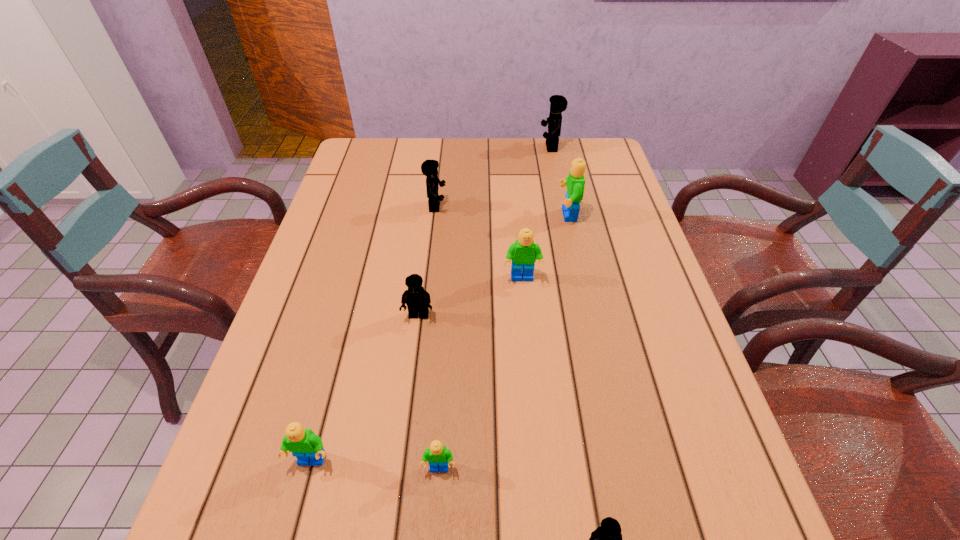
I want to click on vacant area located on the front-facing side of the fifth farthest Lego, so click(x=396, y=496).

Where is `free spot located on the face of the leftmost object`? free spot located on the face of the leftmost object is located at coordinates (300, 503).

At what (x,y) coordinates should I click in order to perform the action: click on object located at the far edge. Please return your answer as a coordinate pair (x, y). Image resolution: width=960 pixels, height=540 pixels. Looking at the image, I should click on (558, 103).

Where is `object located in the left edge section of the desktop`? The image size is (960, 540). object located in the left edge section of the desktop is located at coordinates (305, 445).

Identify the location of object located at the right edge. (558, 103).

At what (x,y) coordinates should I click in order to perform the action: click on object that is at the far right corner. Please return your answer as a coordinate pair (x, y). Image resolution: width=960 pixels, height=540 pixels. Looking at the image, I should click on (558, 103).

Find the location of `vacant position at the far edge of the desktop`. vacant position at the far edge of the desktop is located at coordinates (483, 160).

You are a GUI agent. You are given a task and a screenshot of the screen. Output one action in this format:
    pyautogui.click(x=<x>, y=<y>)
    Task: Click on the free space at the left edge of the desktop
    This screenshot has width=960, height=540.
    Given the screenshot: What is the action you would take?
    pyautogui.click(x=337, y=188)

The image size is (960, 540). In the image, there is a desktop. In order to click on free space at the right edge in this screenshot , I will do `click(717, 445)`.

Where is `free point at the far left corner`? This screenshot has height=540, width=960. free point at the far left corner is located at coordinates (349, 168).